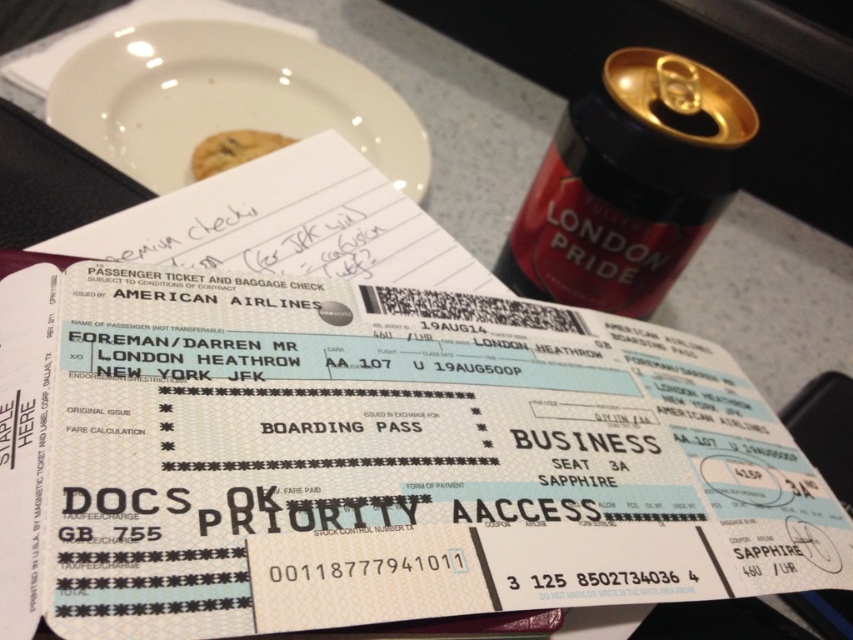
Is red matte can at upper right positioned in front of chocolate chip cookie at upper center?

Yes.

Between red matte can at upper right and chocolate chip cookie at upper center, which one appears on the left side from the viewer's perspective?

From the viewer's perspective, chocolate chip cookie at upper center appears more on the left side.

Between point (630, 67) and point (260, 141), which one is positioned in front?

Positioned in front is point (630, 67).

You are a GUI agent. You are given a task and a screenshot of the screen. Output one action in this format:
    pyautogui.click(x=<x>, y=<y>)
    Task: Click on the red matte can at upper right
    The image size is (853, 640).
    Given the screenshot: What is the action you would take?
    pyautogui.click(x=628, y=184)

Does point (579, 291) come closer to viewer compared to point (396, 173)?

Yes, it is in front of point (396, 173).

Locate an element on the screen. The height and width of the screenshot is (640, 853). red matte can at upper right is located at coordinates (628, 184).

Is point (126, 113) closer to camera compared to point (213, 141)?

Yes, it is.

Does white glossy plate at upper center appear on the left side of chocolate chip cookie at upper center?

In fact, white glossy plate at upper center is to the right of chocolate chip cookie at upper center.

Is point (265, 28) less distant than point (212, 147)?

That is False.

Find the location of `white glossy plate at upper center`. white glossy plate at upper center is located at coordinates (225, 99).